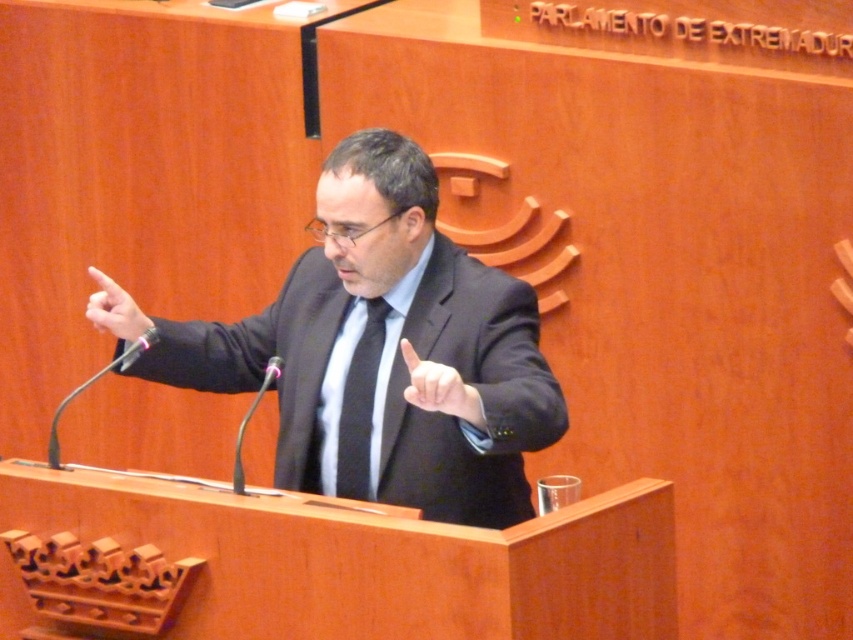
You are a photographer positioned in front of the matte black suit at center. You want to take a closeup photo of the speaker without moving your position. Is your camera lens with a 50mm focal length sufficient to capture the entire suit in frame if you are 2.22 meters away?

The matte black suit at center and viewer are 2.22 meters apart from each other. A 50mm lens on a full frame camera typically has a field of view similar to human vision. At 2.22 meters distance, the 50mm lens should be sufficient to capture the entire suit in frame without needing to move closer.

You are a photographer adjusting your camera settings to capture a photo of the speaker at the podium. You notice two points marked on your viewfinder at coordinates point (543, 401) and point (345, 372). Which point should you focus on to ensure the speaker is in sharp focus?

You should focus on point (543, 401) because it is closer to the camera than point (345, 372), ensuring the speaker is in sharp focus.